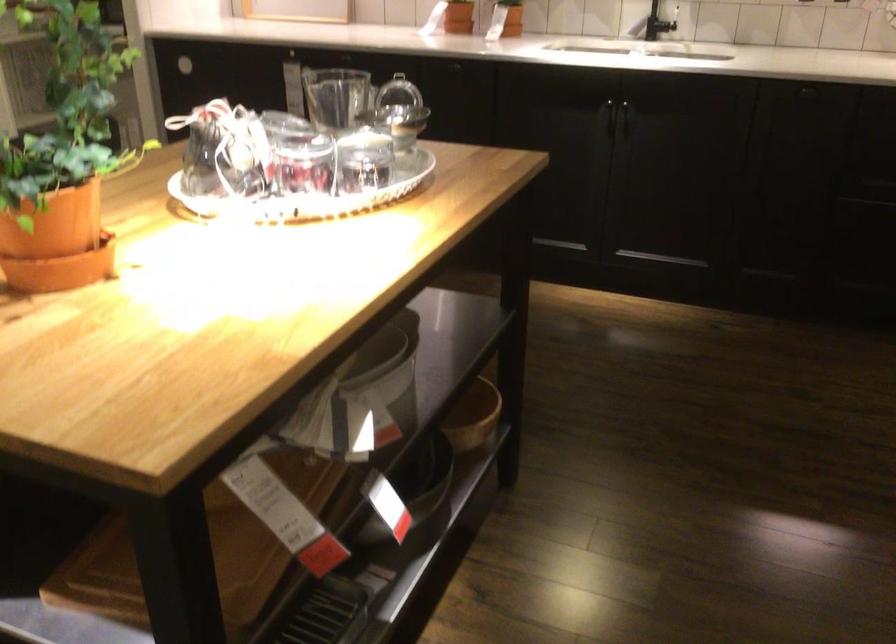
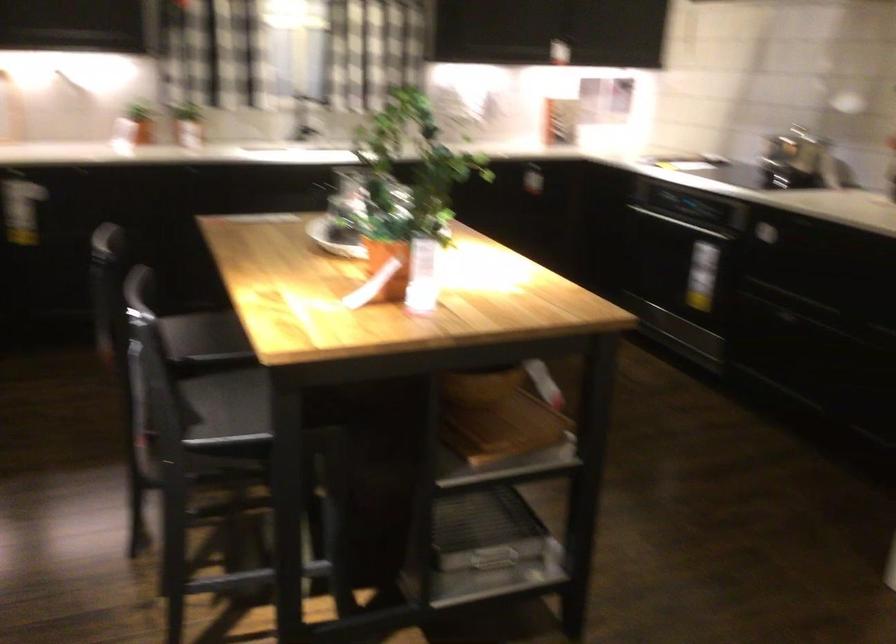
Question: I am providing you with two images of the same scene from different viewpoints. Please identify which objects are invisible in image2.

Choices:
 (A) black chair sitting surface
 (B) white perforated tray
 (C) plastic grocery bag
 (D) metal kettle

Answer: (B)